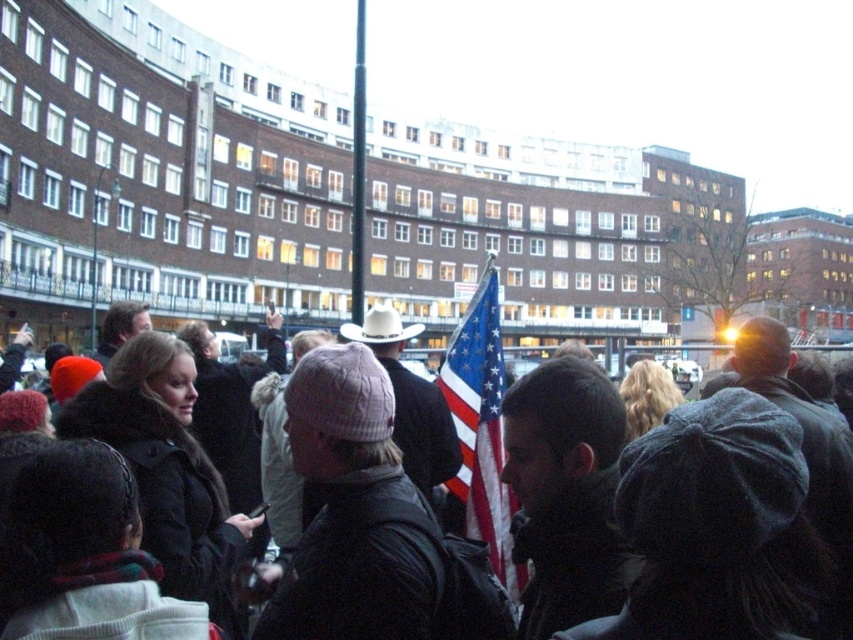
You are a photographer trying to capture a clear shot of both the matte black jacket at center and the american flag at center. Which object should you focus on first to ensure it appears in focus if your camera can only focus on one subject at a time?

The matte black jacket at center is shorter than the american flag at center, so you should focus on the american flag at center first since it is farther away and requires a different focal plane.

You are standing at the camera position and want to hand a leaflet to the person wearing the matte black jacket at center. Considering the distance, can you comfortably walk to them without any obstacles?

The distance between the matte black jacket at center and the camera is 40.32 meters. Walking this distance might be challenging due to the significant distance, but there is no mention of obstacles in the scene description, so it is possible to walk there.